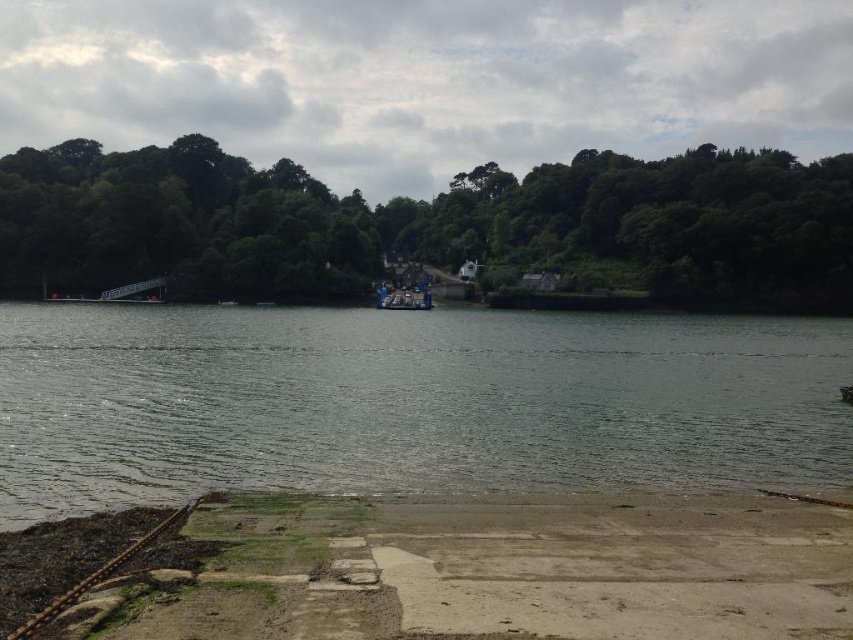
Question: Based on their relative distances, which object is farther from the blue metallic boat at center?

Choices:
 (A) green leafy trees at upper center
 (B) concrete at lower center
 (C) greenish water at center

Answer: (B)

Question: Which point is closer to the camera taking this photo?

Choices:
 (A) (416, 284)
 (B) (113, 244)

Answer: (B)

Question: Is greenish water at center to the left of green leafy trees at upper center from the viewer's perspective?

Choices:
 (A) yes
 (B) no

Answer: (B)

Question: Can you confirm if concrete at lower center is positioned below blue metallic boat at center?

Choices:
 (A) no
 (B) yes

Answer: (B)

Question: Among these objects, which one is farthest from the camera?

Choices:
 (A) concrete at lower center
 (B) green leafy trees at upper center

Answer: (B)

Question: Is greenish water at center below green leafy trees at upper center?

Choices:
 (A) no
 (B) yes

Answer: (B)